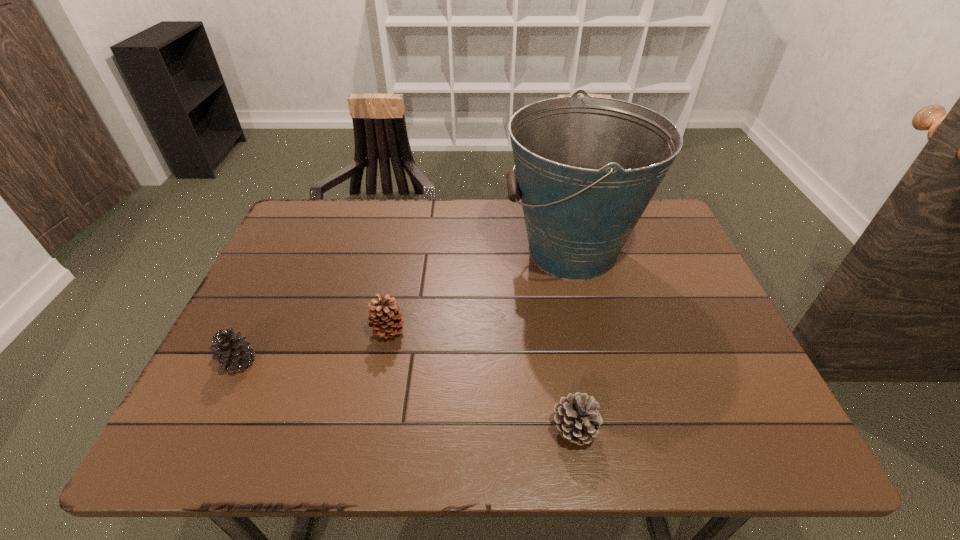
Find the location of a particular element. vacant space at the near edge is located at coordinates (452, 438).

In the image, there is a desktop. Identify the location of vacant region at the left edge. (312, 297).

You are a GUI agent. You are given a task and a screenshot of the screen. Output one action in this format:
    pyautogui.click(x=<x>, y=<y>)
    Task: Click on the free point at the right edge
    
    Given the screenshot: What is the action you would take?
    pyautogui.click(x=662, y=289)

You are a GUI agent. You are given a task and a screenshot of the screen. Output one action in this format:
    pyautogui.click(x=<x>, y=<y>)
    Task: Click on the vacant space at the far left corner of the desktop
    The image size is (960, 540).
    Given the screenshot: What is the action you would take?
    pyautogui.click(x=318, y=232)

Identify the location of vacant space at the near left corner. tap(204, 424).

Where is `vacant space that is in between the third shortest object and the tallest object`? This screenshot has width=960, height=540. vacant space that is in between the third shortest object and the tallest object is located at coordinates (480, 291).

Locate an element on the screen. The width and height of the screenshot is (960, 540). free spot between the nearest object and the second pinecone from right to left is located at coordinates (481, 380).

This screenshot has height=540, width=960. In order to click on vacant area between the tallest object and the rightmost pinecone in this screenshot , I will do `click(573, 340)`.

I want to click on free space between the leftmost pinecone and the farthest object, so click(x=406, y=307).

The image size is (960, 540). I want to click on vacant area that lies between the leftmost pinecone and the tallest pinecone, so click(x=314, y=346).